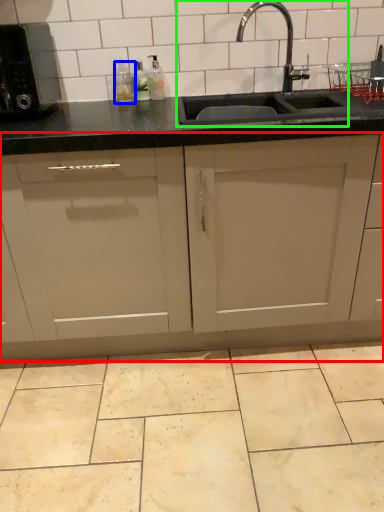
Question: Considering the real-world distances, which object is farthest from cabinetry (highlighted by a red box)? bottle (highlighted by a blue box) or sink (highlighted by a green box)?

Choices:
 (A) bottle
 (B) sink

Answer: (A)